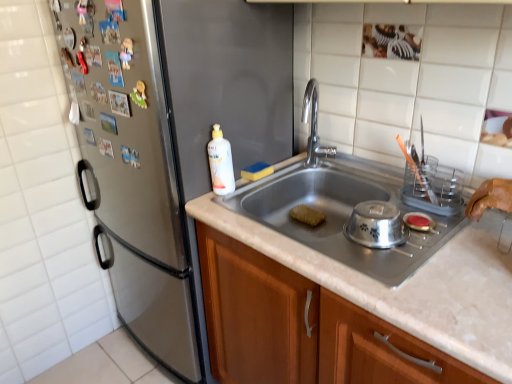
In order to click on free location to the right of yellow sponge at sink, the 1th food viewed from the top in this screenshot , I will do `click(294, 168)`.